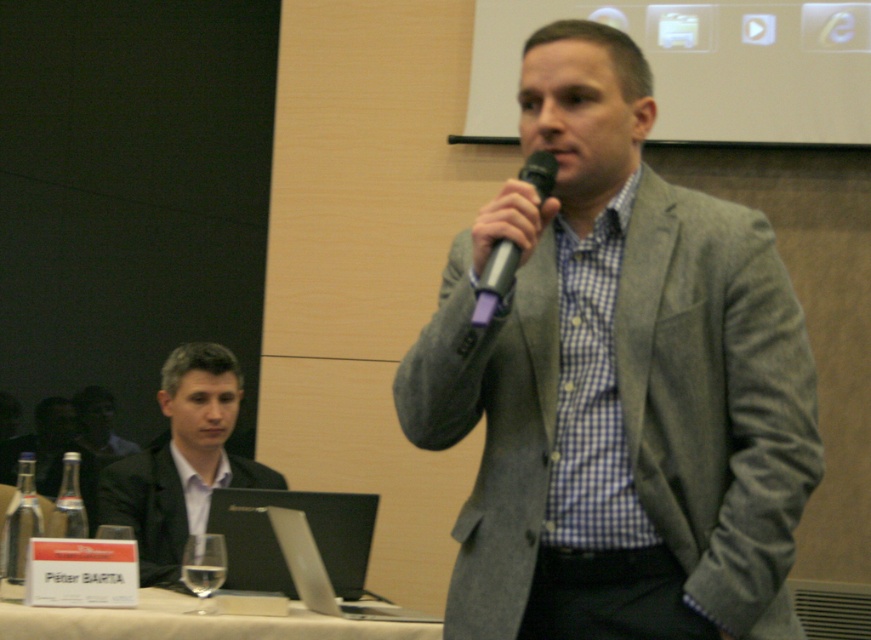
You are organizing a conference and need to place a 1.2 meter wide banner between the black glossy suit at left and the black matte laptop at lower center. Is there enough space between them for the banner?

The black glossy suit at left is positioned on the left side of the black matte laptop at lower center, but the distance between them is not specified. Without knowing the exact distance, it is impossible to determine if the banner will fit.

You are standing in the conference room and want to reach the point marked at coordinates point [275,552]. If your average walking speed is 3 feet per second, how many seconds will it take you to reach that point?

The distance between you and point [275,552] is 9.42 feet. At a speed of 3 feet per second, it will take 9.42 divided by 3, which is approximately 3.14 seconds to reach the point.

You are an event organizer who needs to adjust the microphone stand so that the silver metallic microphone at center is positioned above the black matte laptop at lower center. Is the current setup already meeting this requirement?

The black matte laptop at lower center is below the silver metallic microphone at center, so the current setup already has the microphone positioned above the laptop.